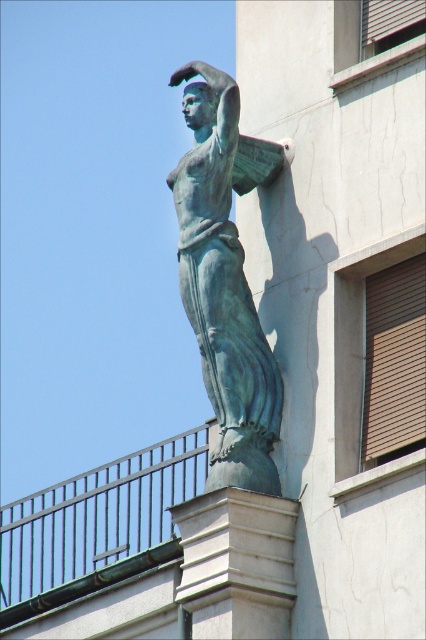
Based on the photo, between green patina statue at upper center and white stone column at center, which one is positioned lower?

white stone column at center

Is green patina statue at upper center below white stone column at center?

No, green patina statue at upper center is not below white stone column at center.

Does point (175, 198) come closer to viewer compared to point (259, 612)?

No.

At what (x,y) coordinates should I click in order to perform the action: click on green patina statue at upper center. Please return your answer as a coordinate pair (x, y). The width and height of the screenshot is (426, 640). Looking at the image, I should click on (224, 289).